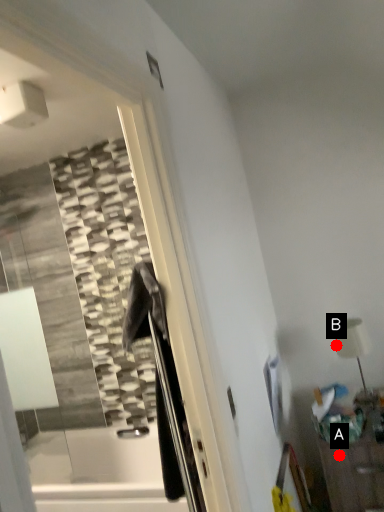
Question: Two points are circled on the image, labeled by A and B beside each circle. Which point is farther to the camera?

Choices:
 (A) A is further
 (B) B is further

Answer: (B)